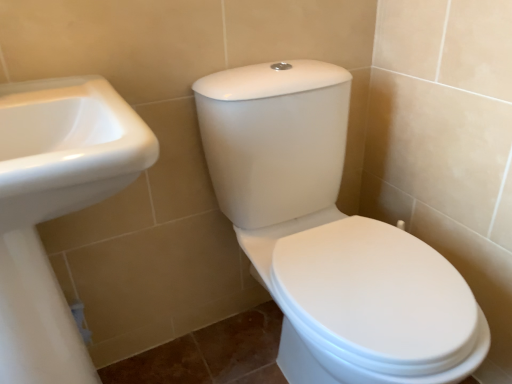
Question: From the image's perspective, is white glossy toilet at center positioned above or below white glossy sink at left?

Choices:
 (A) above
 (B) below

Answer: (A)

Question: Looking at their shapes, would you say white glossy toilet at center is wider or thinner than white glossy sink at left?

Choices:
 (A) wide
 (B) thin

Answer: (A)

Question: Would you say white glossy toilet at center is to the left or to the right of white glossy sink at left in the picture?

Choices:
 (A) right
 (B) left

Answer: (A)

Question: From a real-world perspective, is white glossy sink at left physically located above or below white glossy toilet at center?

Choices:
 (A) below
 (B) above

Answer: (B)

Question: From the image's perspective, is white glossy sink at left above or below white glossy toilet at center?

Choices:
 (A) above
 (B) below

Answer: (B)

Question: Considering the positions of white glossy sink at left and white glossy toilet at center in the image, is white glossy sink at left bigger or smaller than white glossy toilet at center?

Choices:
 (A) big
 (B) small

Answer: (B)

Question: Considering the positions of white glossy sink at left and white glossy toilet at center in the image, is white glossy sink at left wider or thinner than white glossy toilet at center?

Choices:
 (A) thin
 (B) wide

Answer: (A)